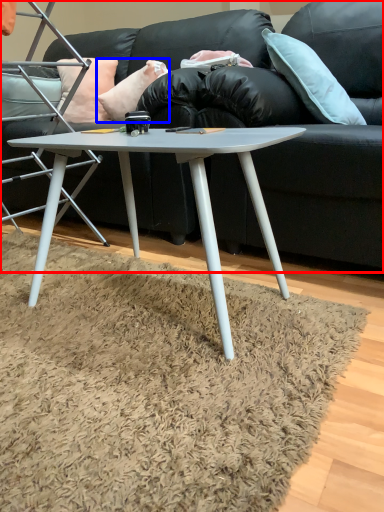
Question: Which point is further to the camera, studio couch (highlighted by a red box) or pillow (highlighted by a blue box)?

Choices:
 (A) studio couch
 (B) pillow

Answer: (B)